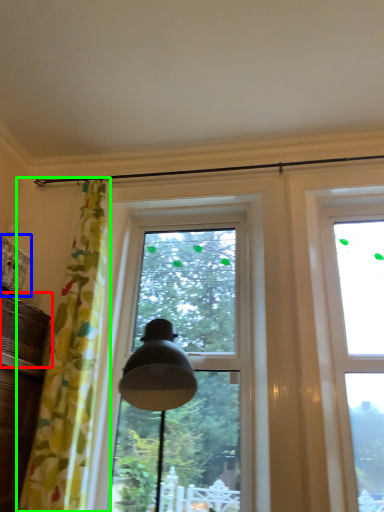
Question: Which object is positioned farthest from basket (highlighted by a red box)? Select from basket (highlighted by a blue box) and curtain (highlighted by a green box).

Choices:
 (A) basket
 (B) curtain

Answer: (B)